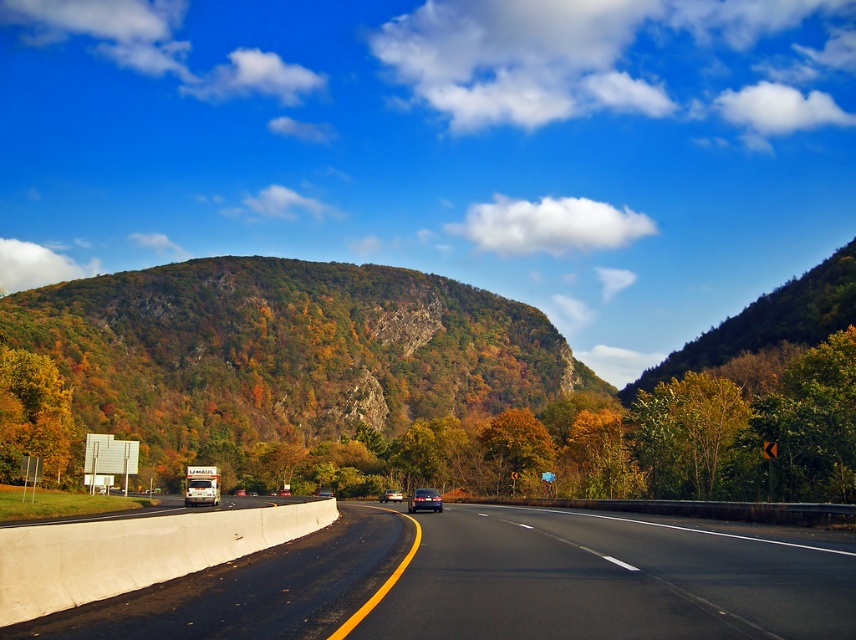
You are driving a car on the highway and see two points marked on the road ahead. The first point is at coordinates point (378, 332) and the second is at point (771, 636). Which point is closer to your current position?

Point (378, 332) is closer to your current position because it is further to the viewer than point (771, 636), meaning it is nearer to you along the road.

You are driving along the smooth asphalt road at center and want to make a U turn to head back. Is the green leafy mountain at center blocking your path?

The green leafy mountain at center is to the left of the smooth asphalt road at center, so it is not blocking the road. You can safely make a U turn.

You are driving a car and see the smooth asphalt road at center and the green matte tree at right. Which object is positioned to the left of the other?

The smooth asphalt road at center is to the left of the green matte tree at right.